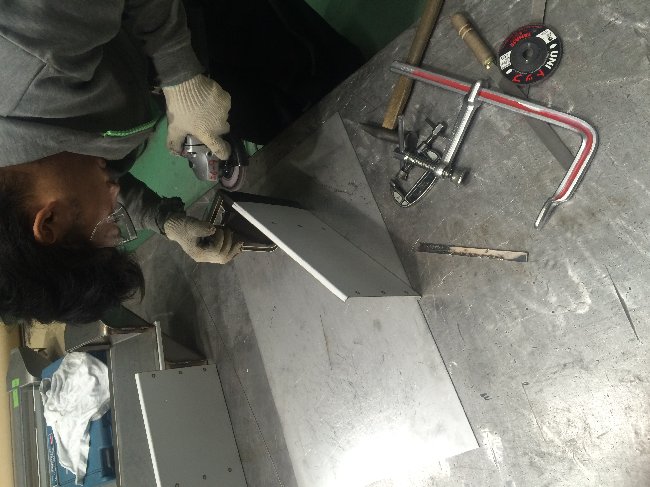
Where is `wall`? wall is located at coordinates (478, 386), (5, 472).